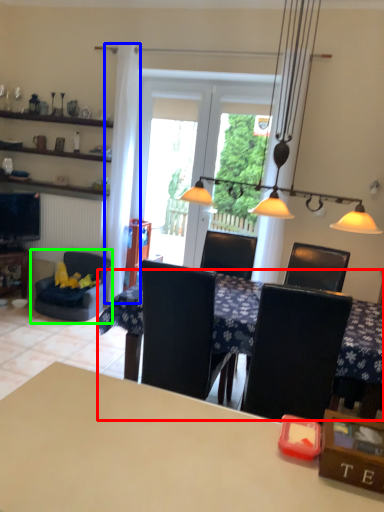
Question: Which is farther away from table (highlighted by a red box)? curtain (highlighted by a blue box) or chair (highlighted by a green box)?

Choices:
 (A) curtain
 (B) chair

Answer: (A)